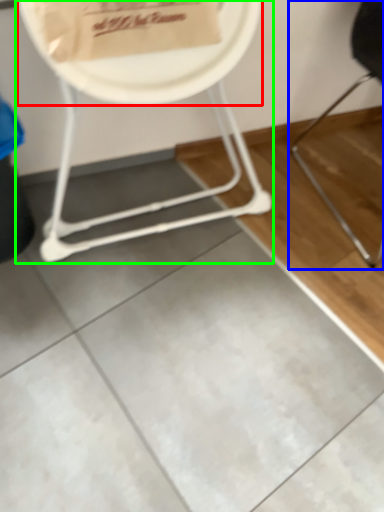
Question: Based on their relative distances, which object is farther from paper plate (highlighted by a red box)? Choose from chair (highlighted by a blue box) and chair (highlighted by a green box).

Choices:
 (A) chair
 (B) chair

Answer: (A)